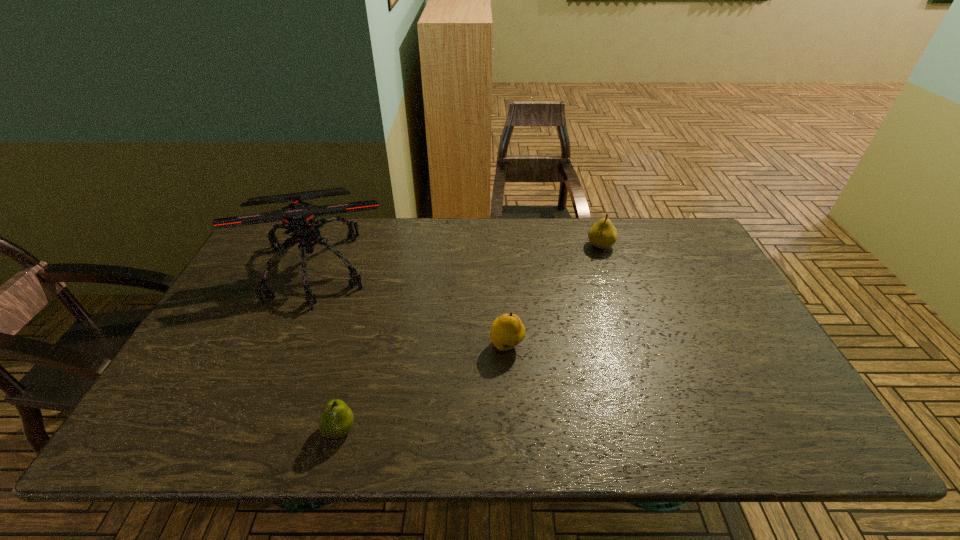
In order to click on free space between the rightmost pear and the drone in this screenshot , I will do `click(458, 256)`.

Locate an element on the screen. The image size is (960, 540). free space between the tallest object and the second pear from left to right is located at coordinates (411, 306).

Identify which object is the closest to the nearest object. Please provide its 2D coordinates. Your answer should be formatted as a tuple, i.e. [(x, y)], where the tuple contains the x and y coordinates of a point satisfying the conditions above.

[(298, 217)]

Find the location of a particular element. The width and height of the screenshot is (960, 540). object that is the closest one to the tallest object is located at coordinates (336, 419).

The image size is (960, 540). Find the location of `pear that can be found as the closest to the nearest pear`. pear that can be found as the closest to the nearest pear is located at coordinates (507, 331).

Choose which pear is the nearest neighbor to the nearest object. Please provide its 2D coordinates. Your answer should be formatted as a tuple, i.e. [(x, y)], where the tuple contains the x and y coordinates of a point satisfying the conditions above.

[(507, 331)]

Where is `vacant region that satisfies the following two spatial constraints: 1. on the back side of the third farthest object; 2. on the right side of the rightmost pear`? The width and height of the screenshot is (960, 540). vacant region that satisfies the following two spatial constraints: 1. on the back side of the third farthest object; 2. on the right side of the rightmost pear is located at coordinates (501, 246).